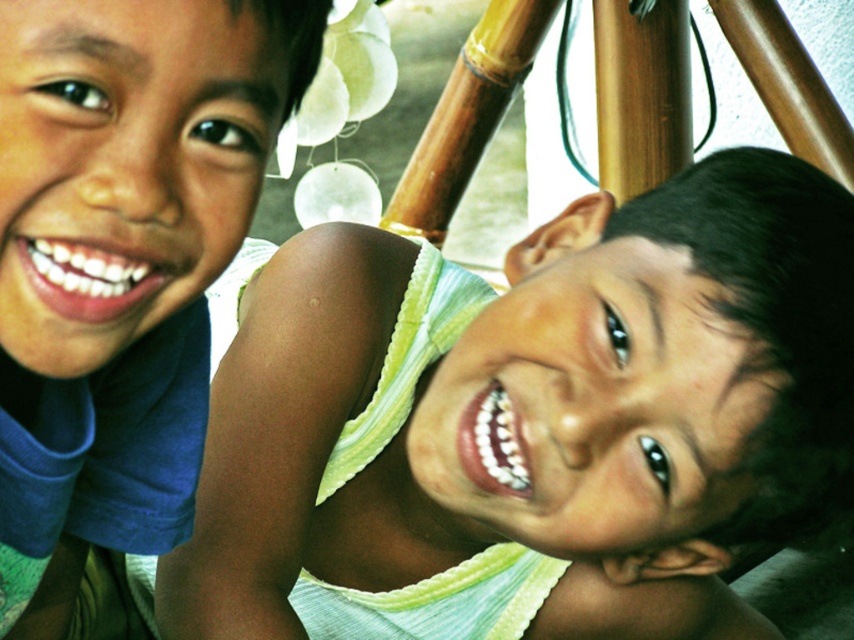
You are a photographer adjusting the focus of your camera. You need to ensure that the matte green shirt at center is in sharp focus. Given that the camera can only focus on objects within a 0.1 unit radius around the point specified, will the focus point at coordinates point (525, 420) successfully capture the matte green shirt at center in focus?

The point (525, 420) marks the location of the matte green shirt at center, so yes, the focus point will successfully capture the matte green shirt at center in focus as it is precisely at the specified coordinates.

You are taking a photo of two children in front of a bamboo playhouse. You notice two points in the image at coordinates point (145,604) and point (184,262). Which point is closer to the camera?

Point (145,604) is further to the camera than point (184,262), so point (145,604) is closer to the camera.